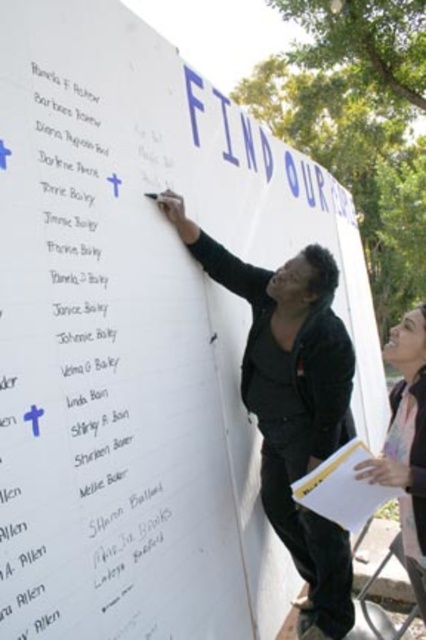
You are a photographer trying to capture a candid shot of the man and woman in the scene. Since the matte black jacket at center and the light brown hair at upper right are both important elements, which one should you focus on to ensure they both fit in the frame without cropping?

The matte black jacket at center is wider than the light brown hair at upper right, so focusing on the matte black jacket at center will ensure both elements fit in the frame without cropping.

You are a photographer trying to capture the scene of the whiteboard. You notice the matte black jacket at center and the light brown hair at upper right. Which object is positioned lower in the image?

The matte black jacket at center is located below light brown hair at upper right, so the matte black jacket at center is positioned lower in the image.

You are a photographer trying to capture the scene of the whiteboard. You notice the matte black jacket at center and the light brown hair at upper right. Which object would appear bigger in your photo?

The matte black jacket at center would appear bigger in the photo because it has a larger size compared to the light brown hair at upper right.